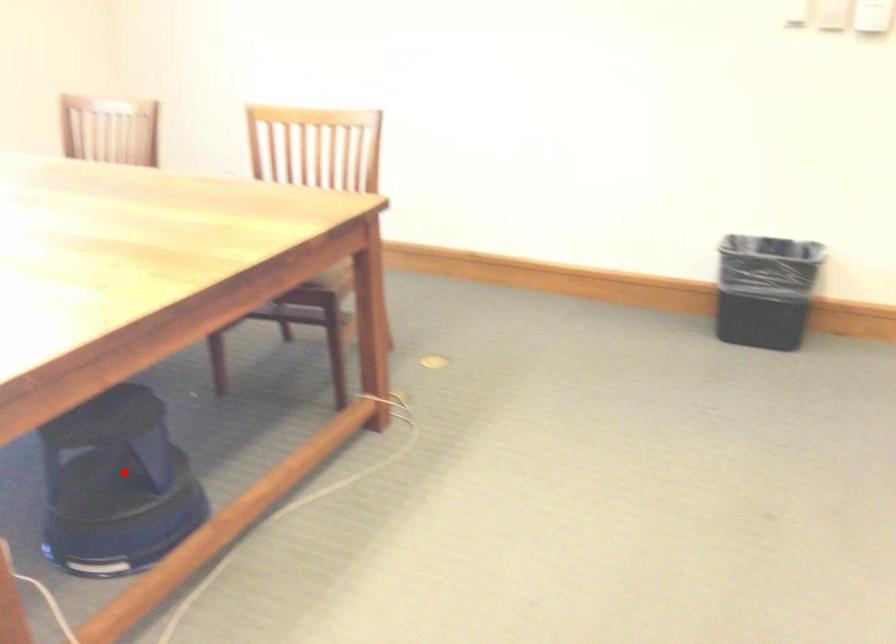
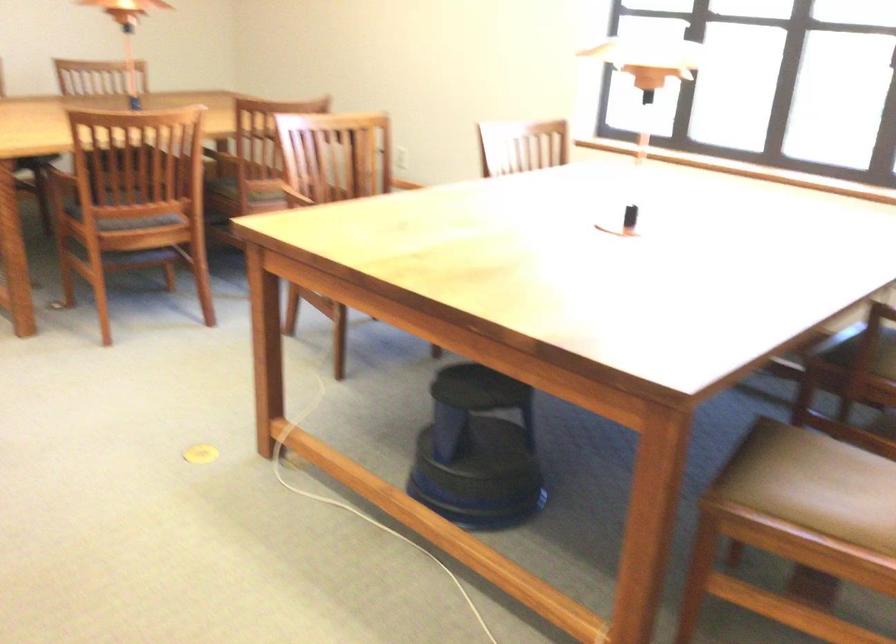
In the second image, find the point that corresponds to the highlighted location in the first image.

(478, 451)